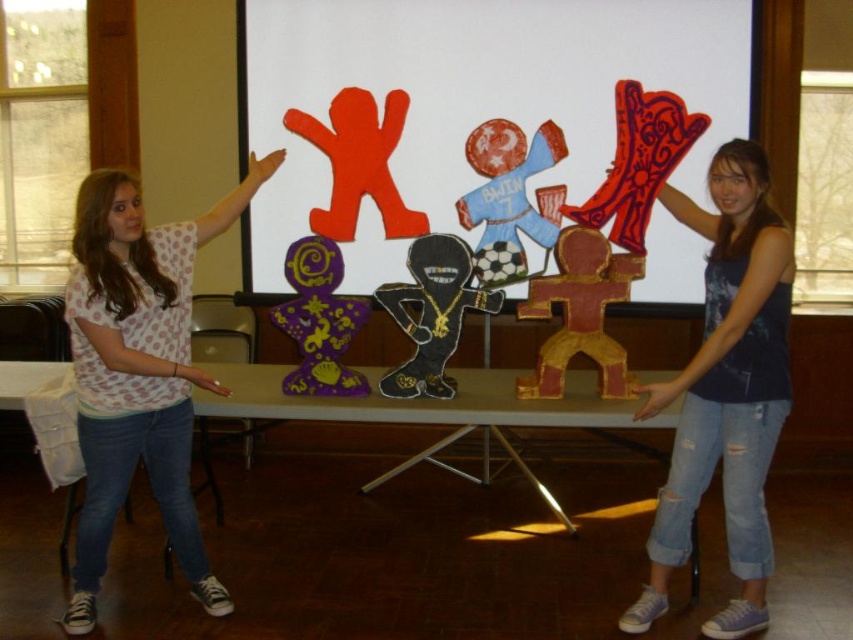
Question: Among these objects, which one is nearest to the camera?

Choices:
 (A) matte red wood mask at upper right
 (B) blue denim jeans at center

Answer: (B)

Question: Is smooth cardboard table at center below matte red wood mask at upper right?

Choices:
 (A) yes
 (B) no

Answer: (A)

Question: Does matte cardboard cutout at center appear over smooth cardboard table at center?

Choices:
 (A) no
 (B) yes

Answer: (B)

Question: Which of the following is the farthest from the observer?

Choices:
 (A) matte cardboard cutout at center
 (B) smooth cardboard table at center
 (C) white dotted shirt at upper left
 (D) orange matte figure at center

Answer: (D)

Question: Considering the relative positions of white dotted shirt at upper left and black felt figure at center in the image provided, where is white dotted shirt at upper left located with respect to black felt figure at center?

Choices:
 (A) left
 (B) right

Answer: (A)

Question: Which point is closer to the camera?

Choices:
 (A) (602, 332)
 (B) (288, 385)
 (C) (309, 221)

Answer: (B)